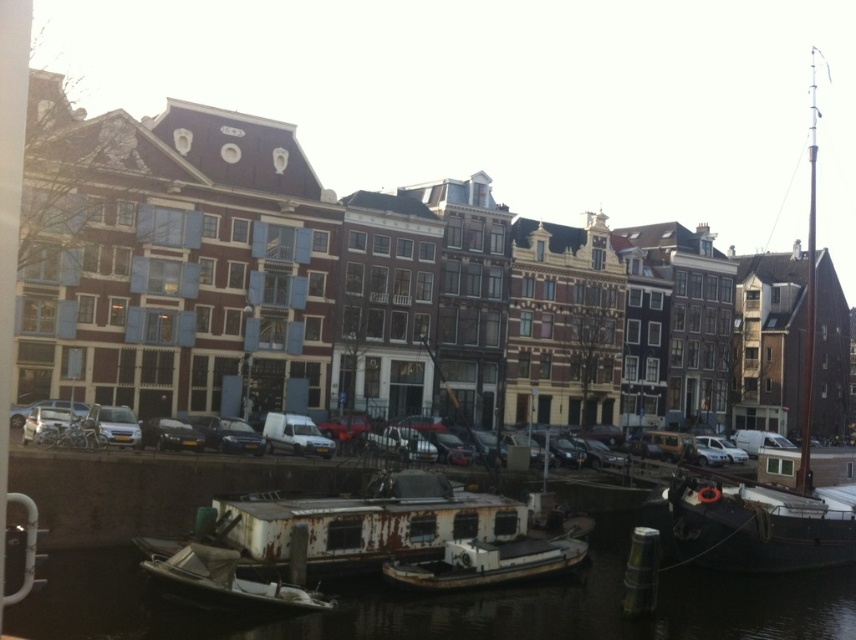
You are a delivery person who needs to park your matte black car at center without blocking the rusty metal water at lower center. Is this possible?

The rusty metal water at lower center is below the matte black car at center, so parking the matte black car at center would block the rusty metal water at lower center. Choose another parking spot.

You are a tour guide leading a group along the canal. You want to point out the rusty metal boat at lower left and the rusty metal boat at center to your tourists. Which boat is located to the right of the other?

The rusty metal boat at center is positioned on the right side of the rusty metal boat at lower left.